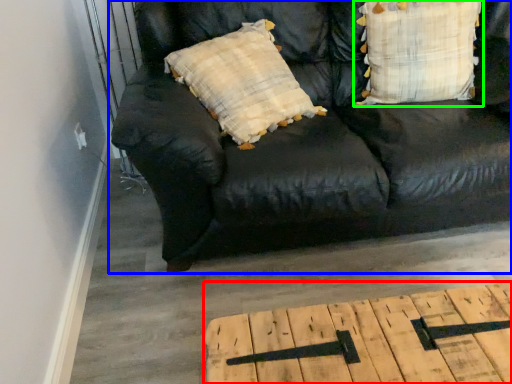
Question: Based on their relative distances, which object is nearer to table (highlighted by a red box)? Choose from studio couch (highlighted by a blue box) and pillow (highlighted by a green box).

Choices:
 (A) studio couch
 (B) pillow

Answer: (A)